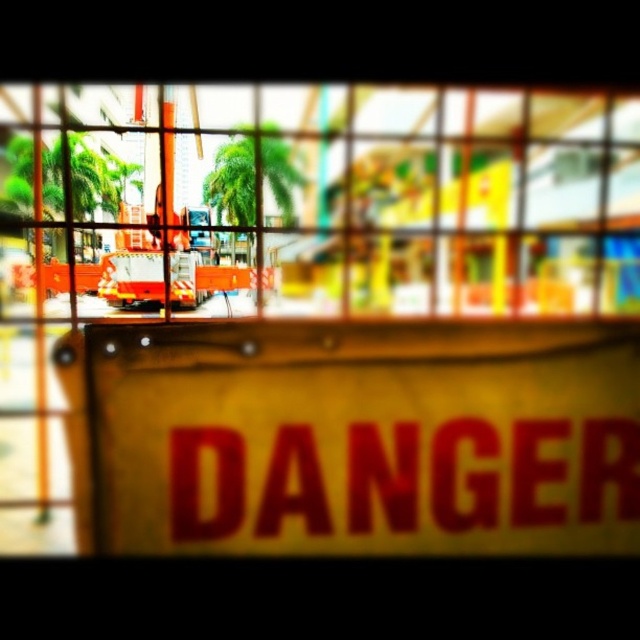
Question: Which point is farther to the camera?

Choices:
 (A) yellow matte sign at center
 (B) yellow/yellowish paper at center

Answer: (A)

Question: Is yellow matte sign at center to the right of yellow/yellowish paper at center from the viewer's perspective?

Choices:
 (A) yes
 (B) no

Answer: (B)

Question: From the image, what is the correct spatial relationship of yellow matte sign at center in relation to yellow/yellowish paper at center?

Choices:
 (A) right
 (B) left

Answer: (B)

Question: Is yellow matte sign at center to the right of yellow/yellowish paper at center from the viewer's perspective?

Choices:
 (A) yes
 (B) no

Answer: (B)

Question: Which point is farther to the camera?

Choices:
 (A) (116, 472)
 (B) (182, 490)

Answer: (B)

Question: Which object is closer to the camera taking this photo?

Choices:
 (A) yellow/yellowish paper at center
 (B) yellow matte sign at center

Answer: (A)